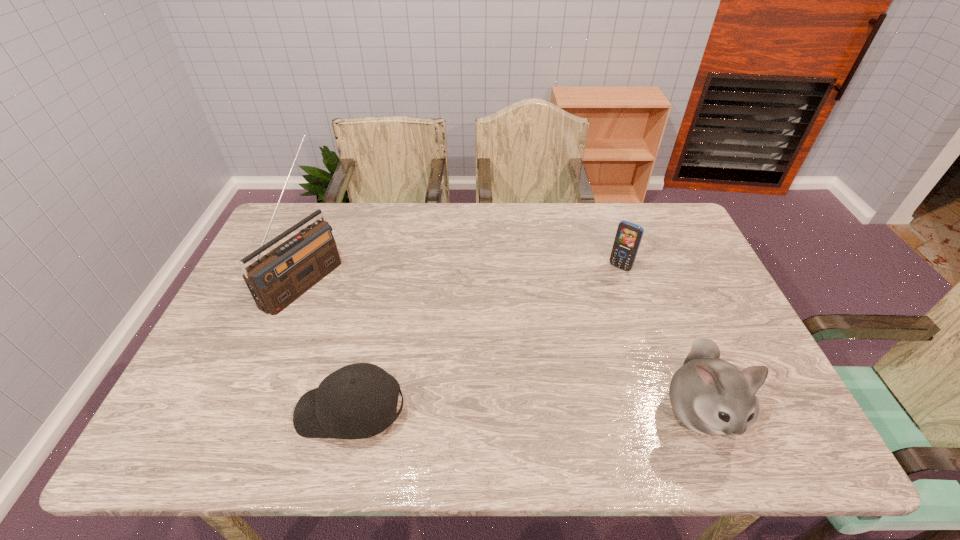
Identify the location of vacant area situated on the front-facing side of the leftmost object. (404, 341).

You are a GUI agent. You are given a task and a screenshot of the screen. Output one action in this format:
    pyautogui.click(x=<x>, y=<y>)
    Task: Click on the vacant area located on the front-facing side of the leftmost object
    
    Given the screenshot: What is the action you would take?
    pyautogui.click(x=422, y=352)

Find the location of a particular element. This screenshot has height=540, width=960. vacant region located 0.320m on the screen of the second shortest object is located at coordinates (562, 339).

You are a GUI agent. You are given a task and a screenshot of the screen. Output one action in this format:
    pyautogui.click(x=<x>, y=<y>)
    Task: Click on the vacant space situated 0.150m on the screen of the second shortest object
    Image resolution: width=960 pixels, height=540 pixels.
    Given the screenshot: What is the action you would take?
    pyautogui.click(x=592, y=301)

The width and height of the screenshot is (960, 540). In order to click on blank area located on the screen of the second shortest object in this screenshot , I will do `click(573, 325)`.

Image resolution: width=960 pixels, height=540 pixels. In order to click on baseball cap at the near edge in this screenshot , I will do `click(357, 401)`.

The height and width of the screenshot is (540, 960). What are the coordinates of `hamster located at the near edge` in the screenshot? It's located at (710, 396).

Image resolution: width=960 pixels, height=540 pixels. I want to click on object that is positioned at the left edge, so click(x=281, y=276).

Identify the location of object present at the right edge. The image size is (960, 540). (710, 396).

Find the location of `object at the near right corner`. object at the near right corner is located at coordinates (710, 396).